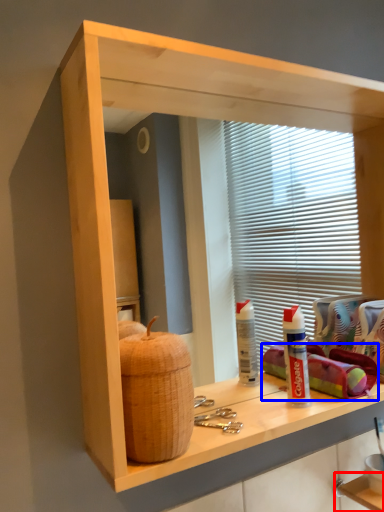
Question: Among these objects, which one is farthest to the camera, shelf (highlighted by a red box) or material (highlighted by a blue box)?

Choices:
 (A) shelf
 (B) material

Answer: (A)